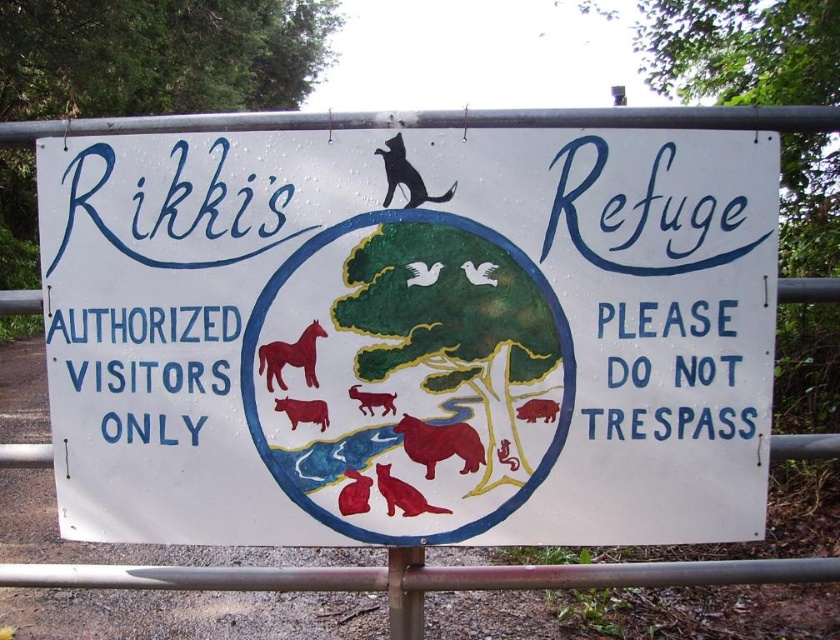
Who is taller, white glossy dove at center or smooth yellow lizard at center?

smooth yellow lizard at center is taller.

Who is shorter, white glossy dove at center or smooth yellow lizard at center?

Standing shorter between the two is white glossy dove at center.

This screenshot has width=840, height=640. Find the location of `white glossy dove at center`. white glossy dove at center is located at coordinates (480, 273).

At what (x,y) coordinates should I click in order to perform the action: click on white glossy dove at center. Please return your answer as a coordinate pair (x, y). Looking at the image, I should click on (480, 273).

Is red matte cat at lower center positioned at the back of smooth yellow lizard at center?

Yes, it is behind smooth yellow lizard at center.

Between point (344, 486) and point (496, 452), which one is positioned behind?

The point (344, 486) is more distant.

This screenshot has height=640, width=840. I want to click on red matte cat at lower center, so click(354, 493).

Who is more distant from viewer, (651,413) or (291,428)?

The point (291,428) is more distant.

Can you confirm if blue painted text at lower right is positioned above smooth brown cow at center?

Yes, blue painted text at lower right is above smooth brown cow at center.

This screenshot has width=840, height=640. What do you see at coordinates (672, 371) in the screenshot?
I see `blue painted text at lower right` at bounding box center [672, 371].

Where is `blue painted text at lower right`? The height and width of the screenshot is (640, 840). blue painted text at lower right is located at coordinates (672, 371).